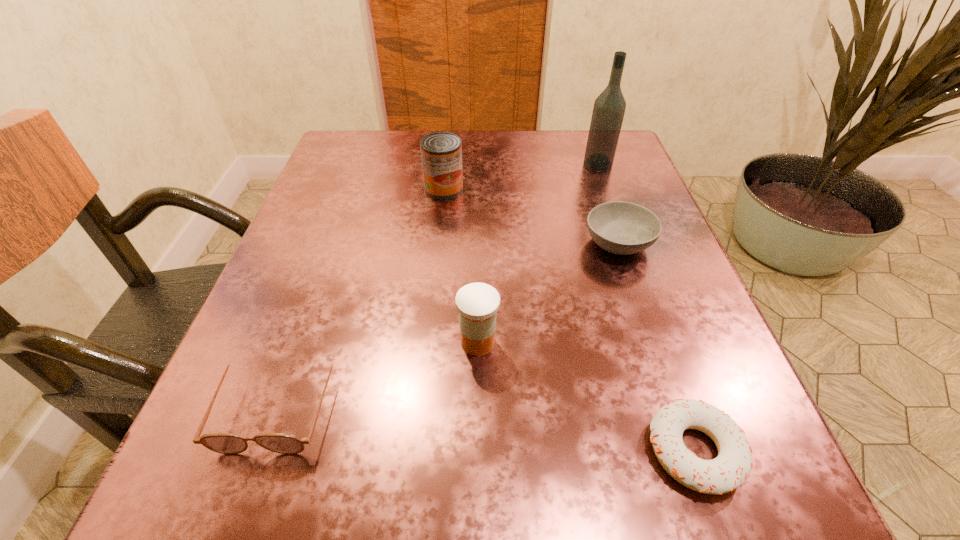
At what (x,y) coordinates should I click in order to perform the action: click on free space between the leftmost object and the shortest object. Please return your answer as a coordinate pair (x, y). The image size is (960, 540). Looking at the image, I should click on (487, 427).

This screenshot has width=960, height=540. I want to click on vacant area that lies between the farthest object and the medicine, so click(538, 253).

You are a GUI agent. You are given a task and a screenshot of the screen. Output one action in this format:
    pyautogui.click(x=<x>, y=<y>)
    Task: Click on the vacant area that lies between the second object from left to right and the medicine
    The height and width of the screenshot is (540, 960).
    Given the screenshot: What is the action you would take?
    pyautogui.click(x=461, y=265)

Identify the location of vacant area that lies between the doughnut and the farthest object. This screenshot has width=960, height=540. (646, 308).

This screenshot has width=960, height=540. What are the coordinates of `free space between the vodka and the leftmost object` in the screenshot? It's located at (439, 284).

The image size is (960, 540). I want to click on unoccupied area between the doughnut and the tallest object, so click(646, 308).

Identify the location of free space between the shortest object and the bowl. The height and width of the screenshot is (540, 960). (657, 347).

Identify which object is the nearest to the doughnut. Please provide its 2D coordinates. Your answer should be formatted as a tuple, i.e. [(x, y)], where the tuple contains the x and y coordinates of a point satisfying the conditions above.

[(477, 303)]

Identify which object is the fourth nearest to the sunglasses. Please provide its 2D coordinates. Your answer should be formatted as a tuple, i.e. [(x, y)], where the tuple contains the x and y coordinates of a point satisfying the conditions above.

[(619, 227)]

I want to click on vacant space that satisfies the following two spatial constraints: 1. on the front side of the shortest object; 2. on the left side of the bowl, so click(x=689, y=451).